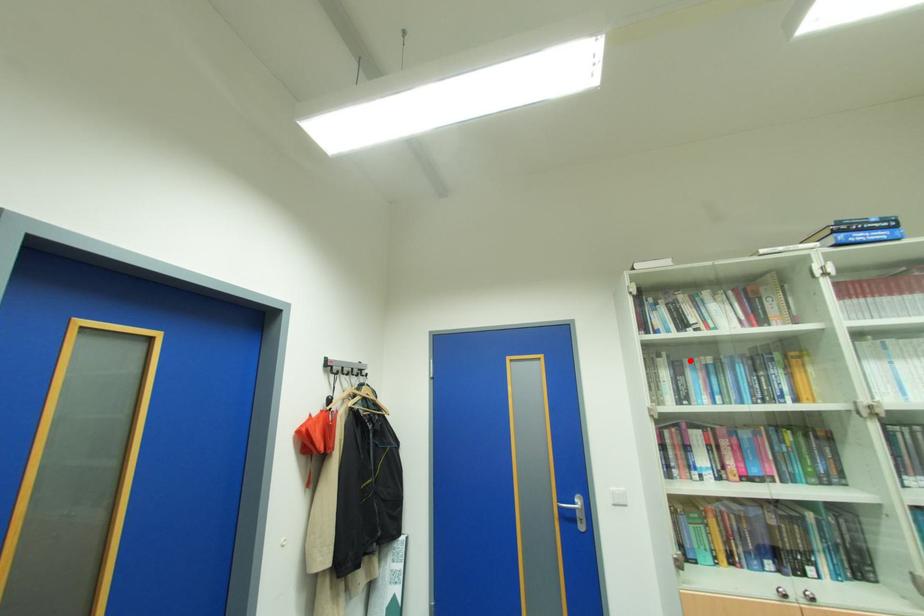
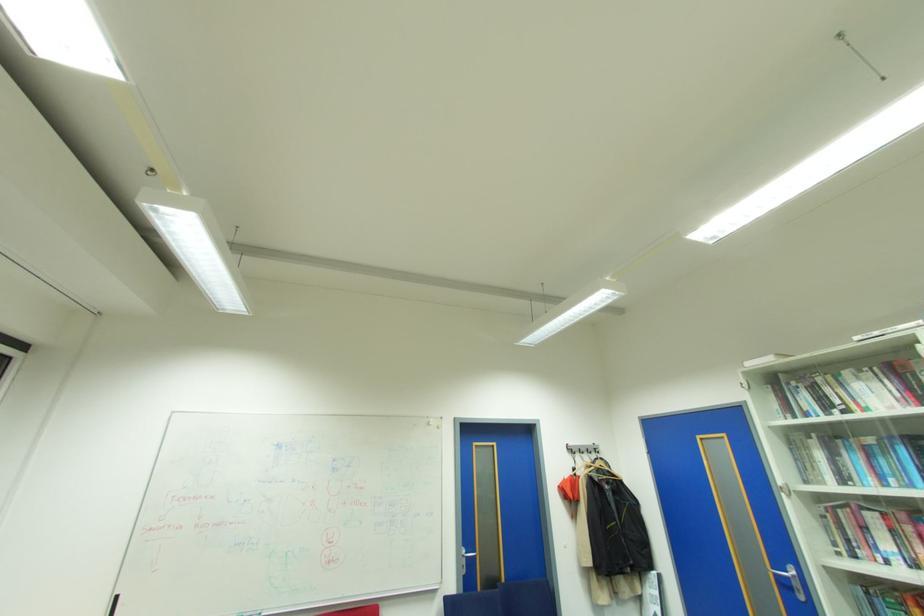
Question: I am providing you with two images of the same scene from different viewpoints. A red point is shown in image1. For the corresponding object point in image2, is it positioned nearer or farther from the camera?

Choices:
 (A) Nearer
 (B) Farther

Answer: (A)